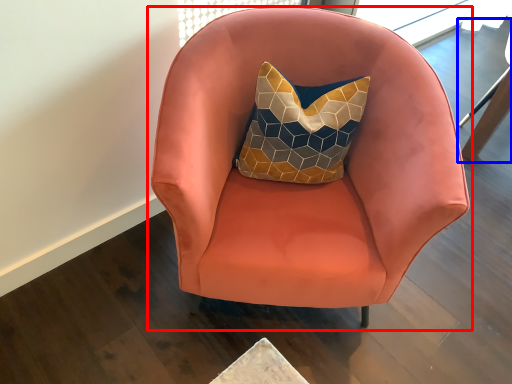
Question: Which point is further to the camera, chair (highlighted by a red box) or swivel chair (highlighted by a blue box)?

Choices:
 (A) chair
 (B) swivel chair

Answer: (B)